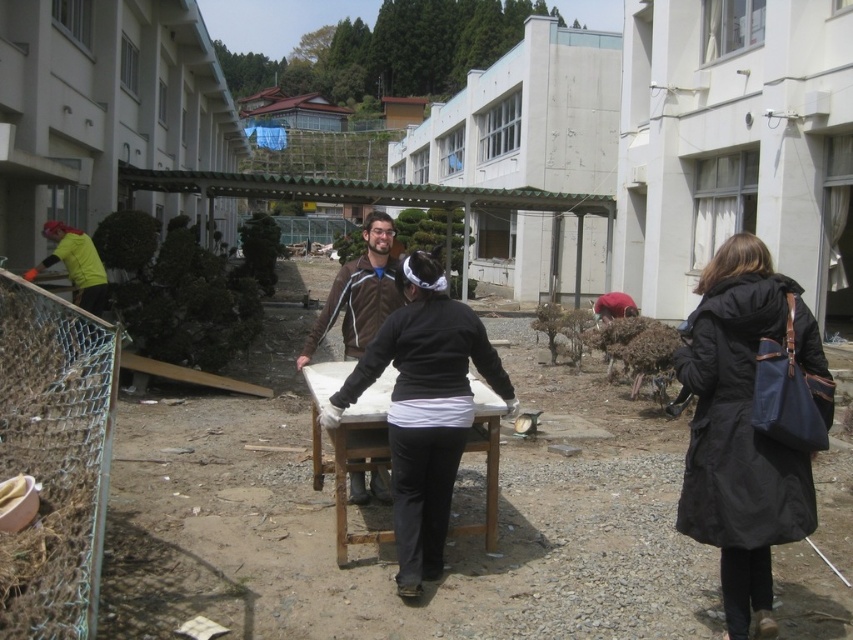
Consider the image. You are standing at the edge of the construction area and see both the black matte jacket at center and the brown leather jacket at center. Which jacket is closer to you?

The black matte jacket at center is closer to you because it is in front of the brown leather jacket at center.